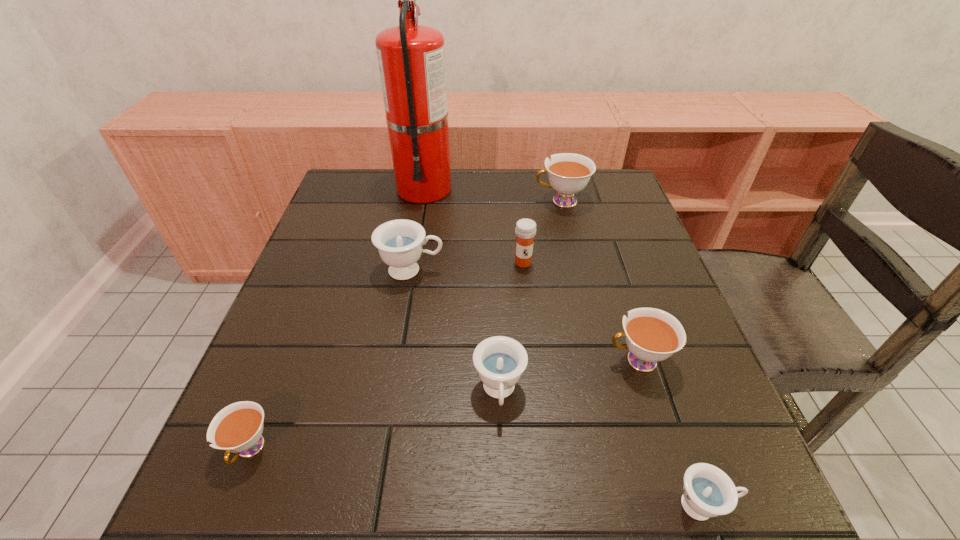
Identify which teacup is the nearest to the nearest object. Please provide its 2D coordinates. Your answer should be formatted as a tuple, i.e. [(x, y)], where the tuple contains the x and y coordinates of a point satisfying the conditions above.

[(652, 335)]

This screenshot has height=540, width=960. I want to click on the closest white teacup relative to the second biggest white teacup, so click(x=568, y=173).

Point out which white teacup is positioned as the nearest to the second smallest white teacup. Please provide its 2D coordinates. Your answer should be formatted as a tuple, i.e. [(x, y)], where the tuple contains the x and y coordinates of a point satisfying the conditions above.

[(568, 173)]

Point out which blue teacup is positioned as the nearest to the medicine. Please provide its 2D coordinates. Your answer should be formatted as a tuple, i.e. [(x, y)], where the tuple contains the x and y coordinates of a point satisfying the conditions above.

[(399, 242)]

Locate which blue teacup is the closest to the leftmost object. Please provide its 2D coordinates. Your answer should be formatted as a tuple, i.e. [(x, y)], where the tuple contains the x and y coordinates of a point satisfying the conditions above.

[(500, 361)]

Image resolution: width=960 pixels, height=540 pixels. Identify the location of vacant region that satisfies the following two spatial constraints: 1. on the side of the biggest white teacup with the handle; 2. on the side of the leftmost object with the handle. [x=621, y=449].

This screenshot has height=540, width=960. Identify the location of free spot that satisfies the following two spatial constraints: 1. on the label side of the medicine; 2. on the side of the leftmost blue teacup with the handle. (524, 270).

The height and width of the screenshot is (540, 960). Identify the location of free space in the image that satisfies the following two spatial constraints: 1. on the side of the second farthest white teacup with the handle; 2. on the side of the second blue teacup from right to left with the handle. (648, 392).